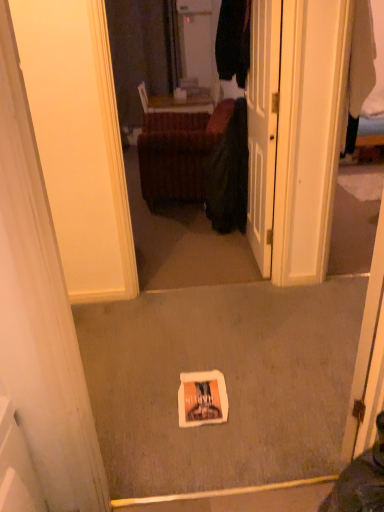
This screenshot has height=512, width=384. Find the location of `vacant area in front of dark green fabric at center`. vacant area in front of dark green fabric at center is located at coordinates (198, 244).